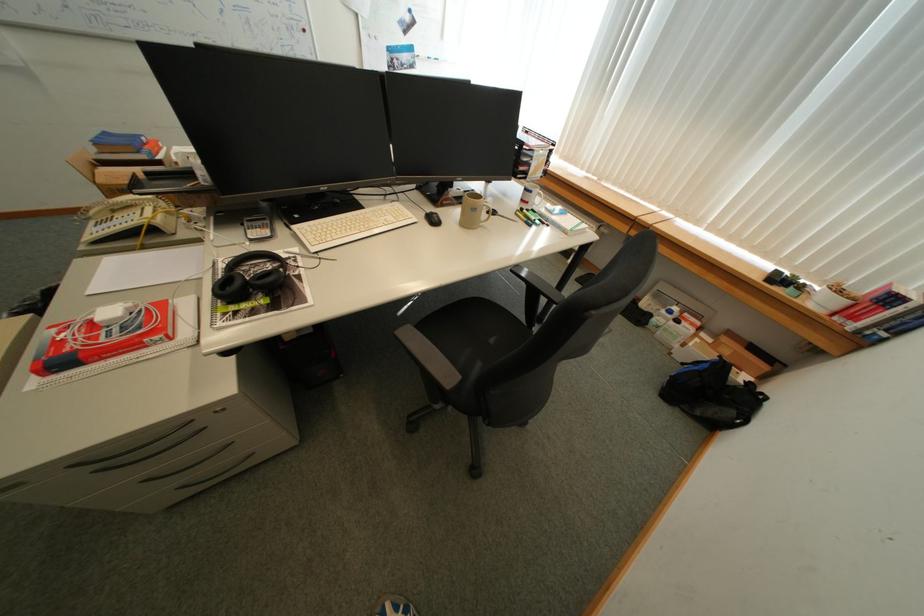
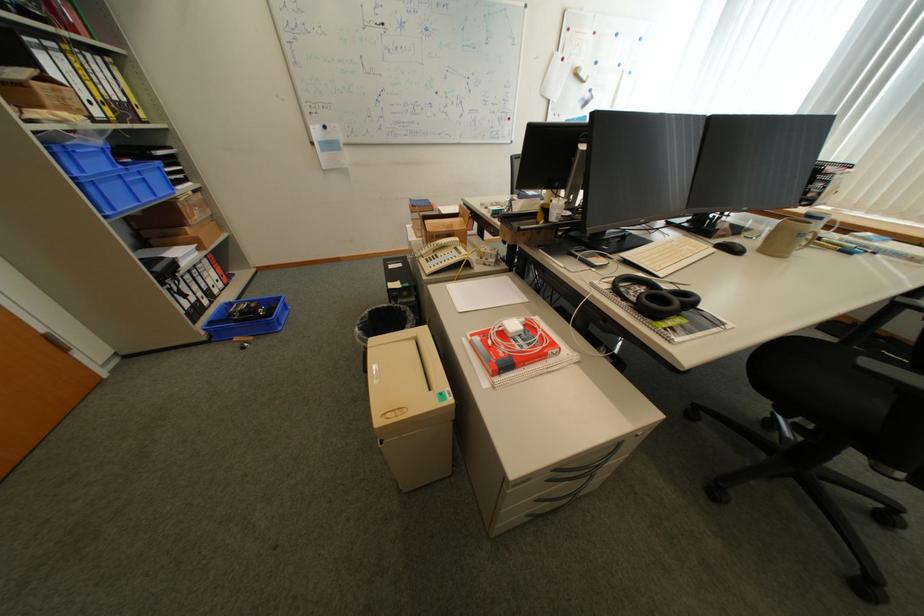
Question: The images are taken continuously from a first-person perspective. In which direction is your viewpoint rotating?

Choices:
 (A) Left
 (B) Right
 (C) Up
 (D) Down

Answer: (A)